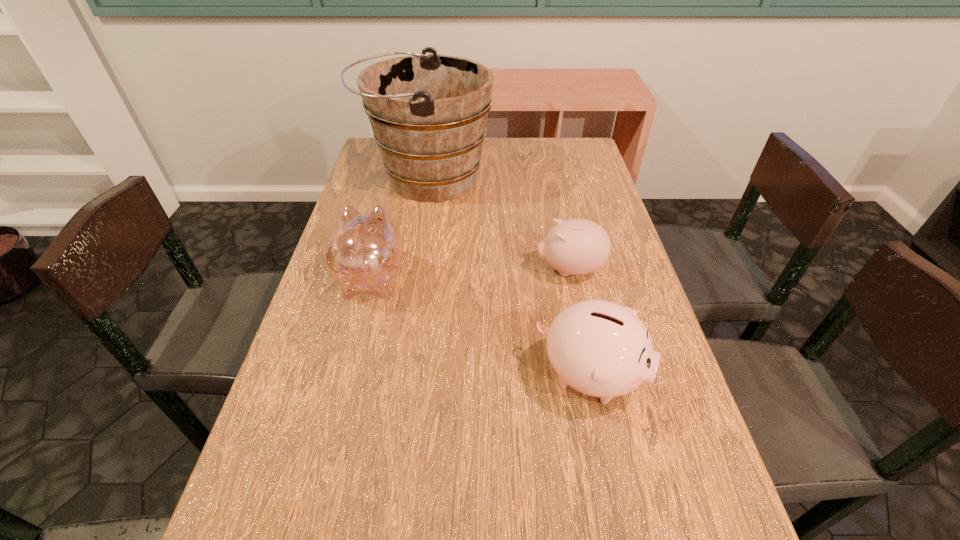
Identify the location of the farthest object. This screenshot has height=540, width=960. (428, 112).

Where is `the tallest object`? the tallest object is located at coordinates (428, 112).

The width and height of the screenshot is (960, 540). Identify the location of the leftmost piggy bank. (364, 252).

Locate an element on the screen. the nearest object is located at coordinates (602, 349).

In order to click on the shortest object in this screenshot , I will do `click(576, 246)`.

In order to click on vacant space located 0.070m on the front facing side of the leftmost piggy bank in this screenshot , I will do `click(383, 234)`.

I want to click on vacant space located 0.200m on the front facing side of the leftmost piggy bank, so click(x=390, y=207).

Locate an element on the screen. free location located on the front facing side of the leftmost piggy bank is located at coordinates (395, 188).

Locate an element on the screen. The image size is (960, 540). vacant area located on the back of the nearest piggy bank is located at coordinates pyautogui.click(x=569, y=278).

You are a GUI agent. You are given a task and a screenshot of the screen. Output one action in this format:
    pyautogui.click(x=<x>, y=<y>)
    Task: Click on the vacant space located 0.100m at the snout of the shortest piggy bank
    Image resolution: width=960 pixels, height=540 pixels.
    Given the screenshot: What is the action you would take?
    pyautogui.click(x=494, y=269)